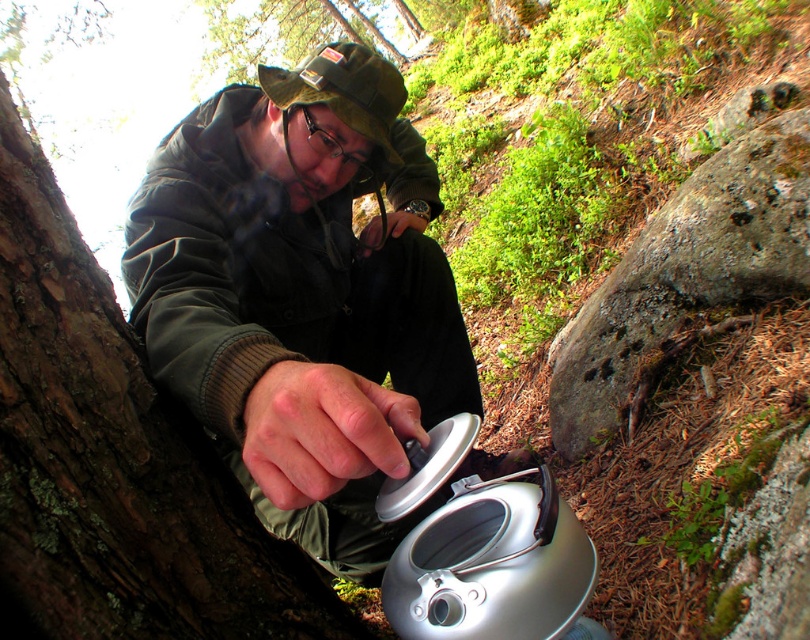
You are navigating through a forest and need to reach a hidden treasure located at point B. You are currently at point A. The coordinates for point A are point A at (339,298) and point B are point B at (162,516). According to the map, which direction should you move to get closer to point B?

Since point A at (339,298) is behind point B at (162,516), you should move forward in the direction towards point B at (162,516) to get closer.

Based on the scene description, which object is wider, the matte black jacket at center or the brown rough bark at left?

The matte black jacket at center is wider than the brown rough bark at left according to the description.